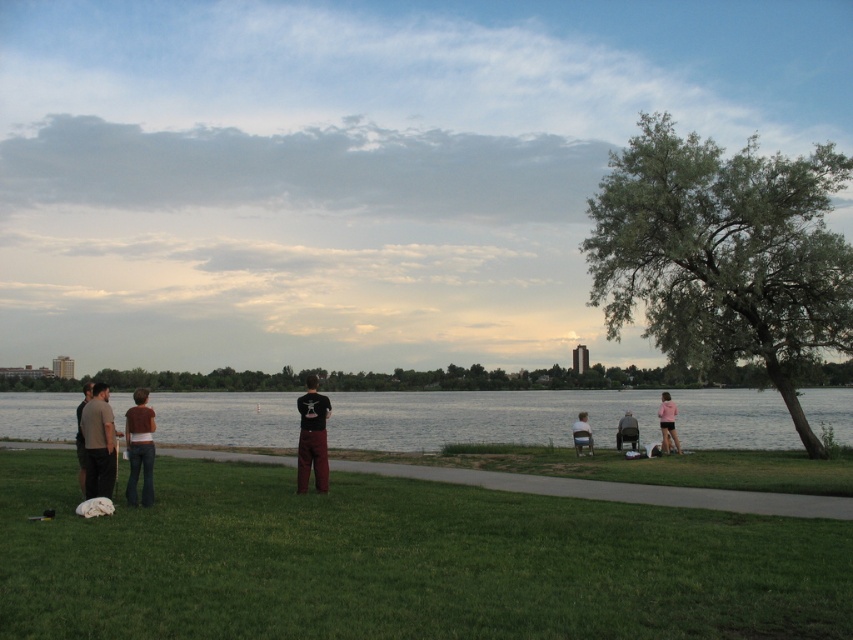
Question: Does dark gray pants at lower left lie in front of smooth black shirt at center?

Choices:
 (A) yes
 (B) no

Answer: (A)

Question: Among these points, which one is nearest to the camera?

Choices:
 (A) (138, 397)
 (B) (717, 403)

Answer: (A)

Question: Estimate the real-world distances between objects in this image. Which object is farther from the black matte shirt at center?

Choices:
 (A) dark gray fabric bag at lower center
 (B) smooth black shirt at center

Answer: (A)

Question: Which of the following is the farthest from the observer?

Choices:
 (A) dark gray fabric bag at lower center
 (B) pink fabric shorts at lower right
 (C) green grass at lower center

Answer: (A)

Question: Considering the relative positions of dark gray pants at lower left and smooth black shirt at center in the image provided, where is dark gray pants at lower left located with respect to smooth black shirt at center?

Choices:
 (A) below
 (B) above

Answer: (B)

Question: Is black matte shirt at center wider than brown cotton shirt at lower left?

Choices:
 (A) no
 (B) yes

Answer: (A)